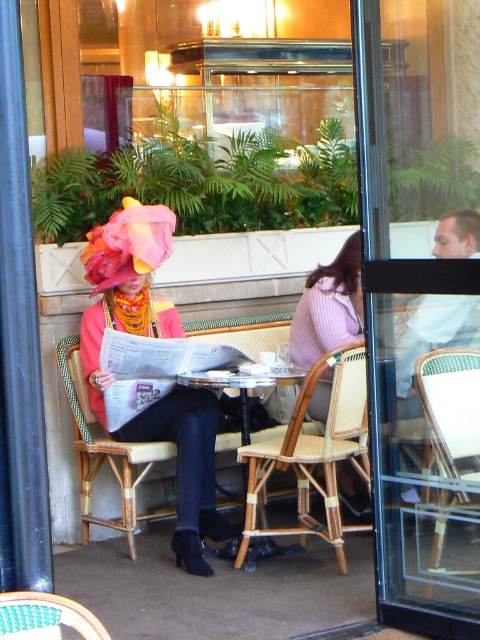
Question: Which of these objects is positioned farthest from the transparent glass door at center?

Choices:
 (A) pink fabric hat at center
 (B) woven rattan chair at lower left
 (C) matte pink fabric hat at center
 (D) wooden table at center

Answer: (B)

Question: Estimate the real-world distances between objects in this image. Which object is closer to the matte pink fabric hat at center?

Choices:
 (A) transparent glass door at center
 (B) woven wood chair at center

Answer: (A)

Question: Where is matte pink fabric hat at center located in relation to transparent glass door at center in the image?

Choices:
 (A) left
 (B) right

Answer: (A)

Question: Is matte pink fabric hat at center to the left of woven wood chair at center from the viewer's perspective?

Choices:
 (A) no
 (B) yes

Answer: (B)

Question: Estimate the real-world distances between objects in this image. Which object is farther from the pink fabric hat at center?

Choices:
 (A) woven rattan chair at center
 (B) matte pink fabric hat at center
 (C) woven wood chair at center

Answer: (C)

Question: Is matte pink fabric hat at center smaller than woven wood chair at center?

Choices:
 (A) yes
 (B) no

Answer: (B)